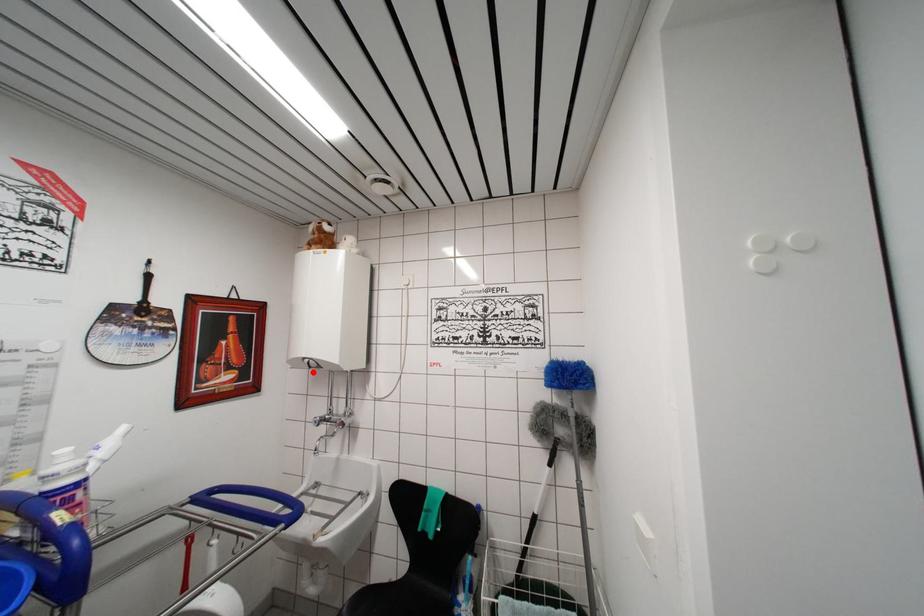
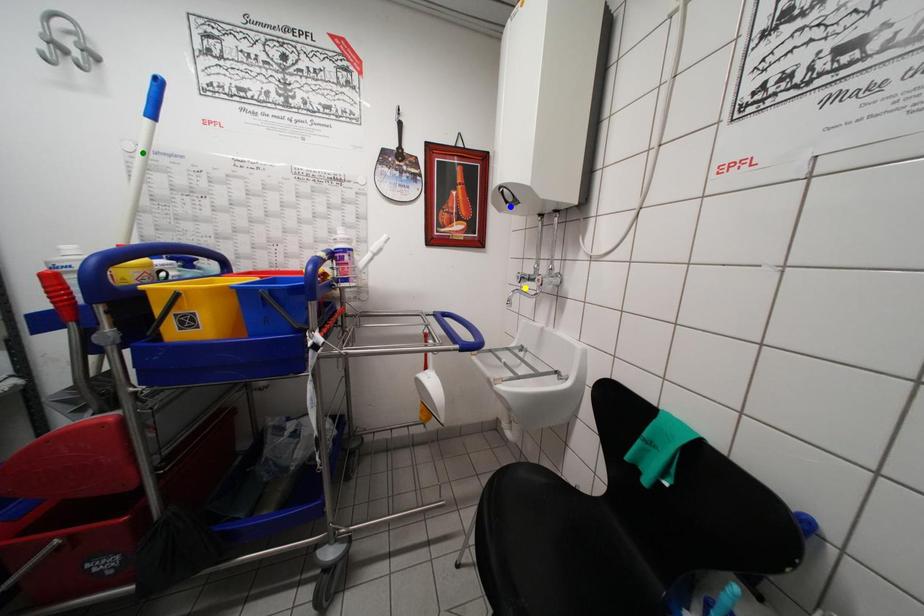
Question: I am providing you with two images of the same scene from different viewpoints. A red point is marked on the first image. You are given multiple points on the second image. In image 2, which mark is for the same physical point as the one in image 1?

Choices:
 (A) blue point
 (B) green point
 (C) yellow point

Answer: (A)